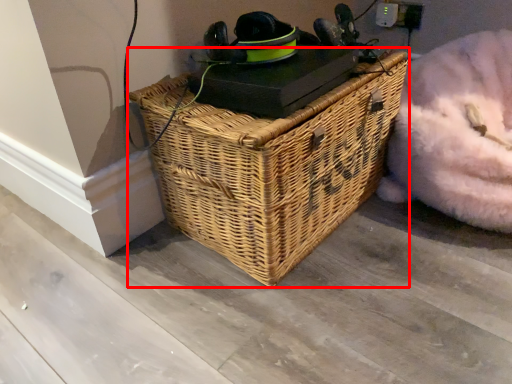
Question: From the image's perspective, what is the correct spatial relationship of picnic basket (annotated by the red box) in relation to bean bag chair?

Choices:
 (A) below
 (B) above

Answer: (A)